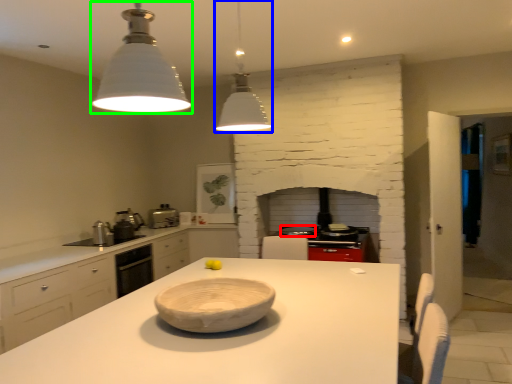
Question: Which object is the farthest from appliance (highlighted by a red box)? Choose among these: light fixture (highlighted by a blue box) or light fixture (highlighted by a green box).

Choices:
 (A) light fixture
 (B) light fixture

Answer: (B)